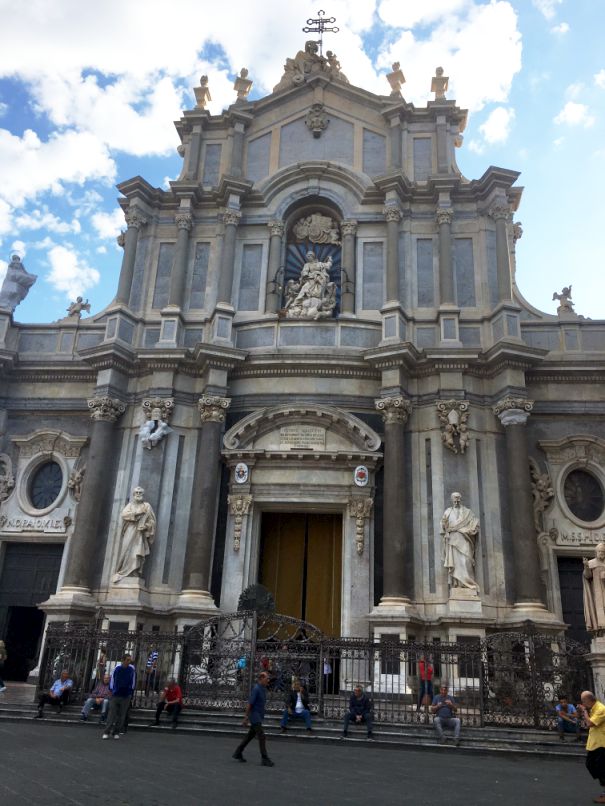
Locate an element on the screen. right window is located at coordinates (581, 496).